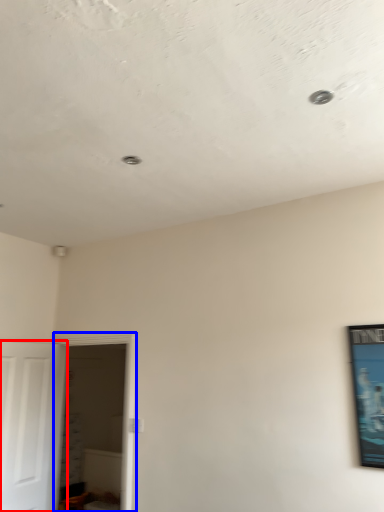
Question: Which point is further to the camera, door (highlighted by a red box) or glass door (highlighted by a blue box)?

Choices:
 (A) door
 (B) glass door

Answer: (B)